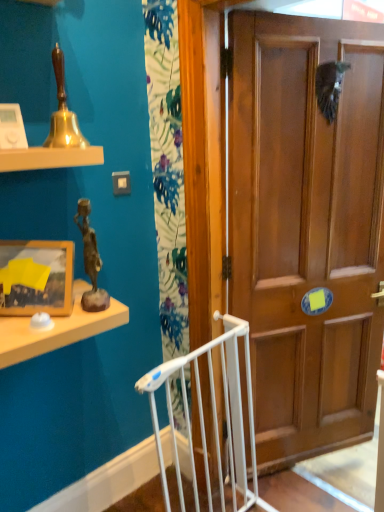
Question: Is wooden framed picture at left positioned with its back to bronze statue at upper left?

Choices:
 (A) yes
 (B) no

Answer: (B)

Question: Can you confirm if wooden framed picture at left is wider than bronze statue at upper left?

Choices:
 (A) no
 (B) yes

Answer: (A)

Question: Considering the relative sizes of wooden framed picture at left and bronze statue at upper left in the image provided, is wooden framed picture at left bigger than bronze statue at upper left?

Choices:
 (A) yes
 (B) no

Answer: (A)

Question: Is wooden framed picture at left not within bronze statue at upper left?

Choices:
 (A) yes
 (B) no

Answer: (A)

Question: Would you consider wooden framed picture at left to be distant from bronze statue at upper left?

Choices:
 (A) yes
 (B) no

Answer: (B)

Question: Is point (x=82, y=240) positioned closer to the camera than point (x=67, y=265)?

Choices:
 (A) farther
 (B) closer

Answer: (A)

Question: In the image, is bronze statue at upper left positioned in front of or behind wooden framed picture at left?

Choices:
 (A) front
 (B) behind

Answer: (A)

Question: Looking at the image, does bronze statue at upper left seem bigger or smaller compared to wooden framed picture at left?

Choices:
 (A) small
 (B) big

Answer: (A)

Question: From the image's perspective, is bronze statue at upper left above or below wooden framed picture at left?

Choices:
 (A) above
 (B) below

Answer: (A)

Question: Visually, is wooden door at center positioned to the left or to the right of bronze statue at upper left?

Choices:
 (A) right
 (B) left

Answer: (A)

Question: Is point (344, 357) closer or farther from the camera than point (84, 291)?

Choices:
 (A) farther
 (B) closer

Answer: (A)

Question: Relative to bronze statue at upper left, is wooden door at center in front or behind?

Choices:
 (A) behind
 (B) front

Answer: (A)

Question: In terms of height, does wooden door at center look taller or shorter compared to bronze statue at upper left?

Choices:
 (A) short
 (B) tall

Answer: (B)

Question: Based on their positions, is wooden door at center located to the left or right of wooden framed picture at left?

Choices:
 (A) left
 (B) right

Answer: (B)

Question: From their relative heights in the image, would you say wooden door at center is taller or shorter than wooden framed picture at left?

Choices:
 (A) tall
 (B) short

Answer: (A)